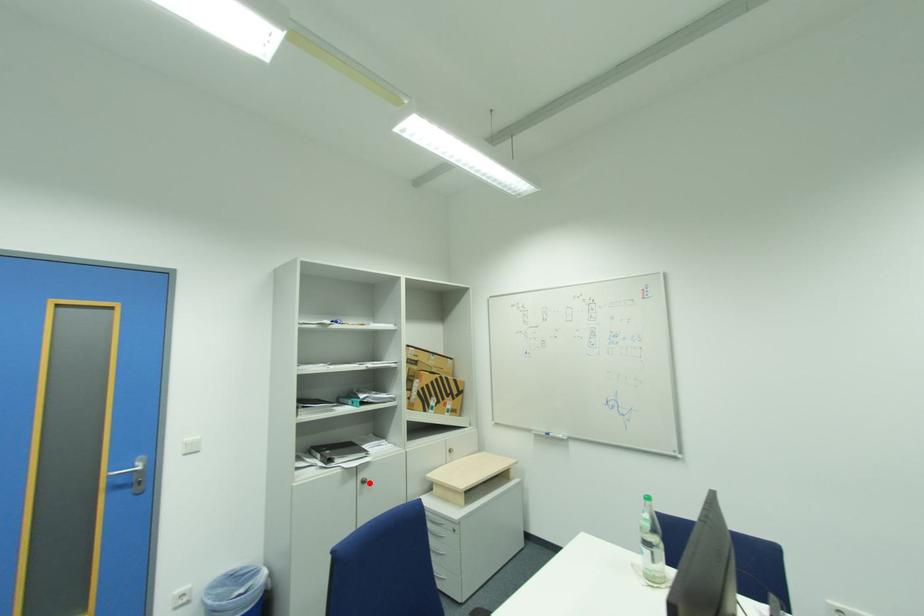
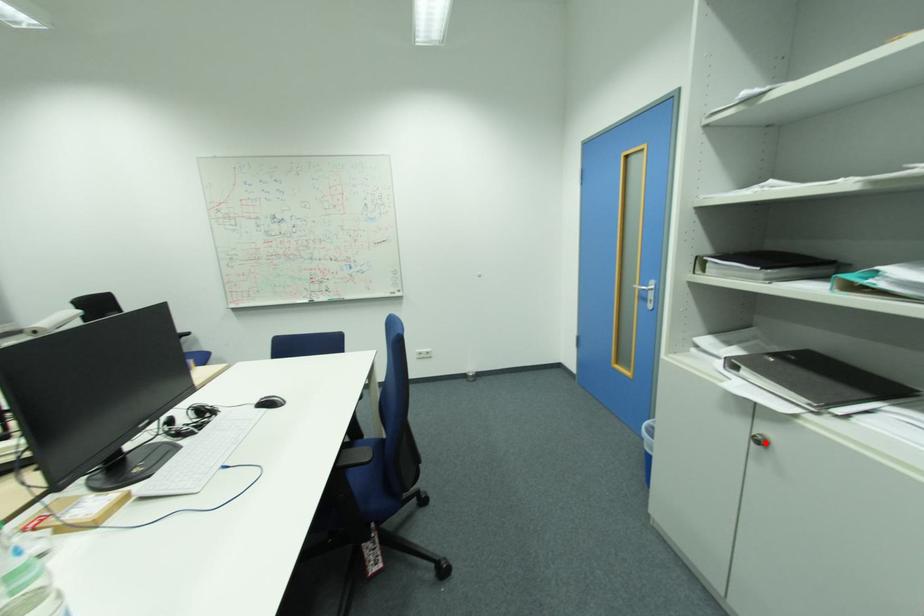
I am providing you with two images of the same scene from different viewpoints. A red point is marked on the first image and another point is marked on the second image. Do the highlighted points in image1 and image2 indicate the same real-world spot?

Yes